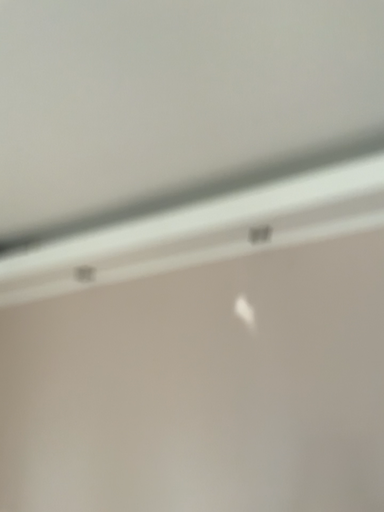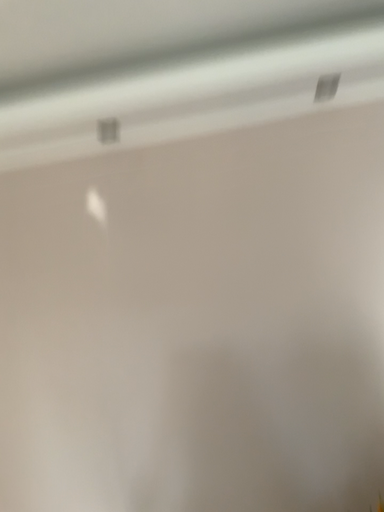
Question: Which way did the camera rotate in the video?

Choices:
 (A) rotated upward
 (B) rotated downward

Answer: (B)